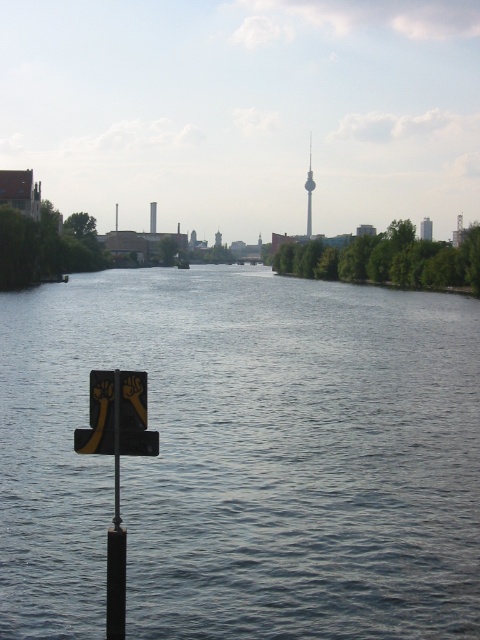
Question: Based on their relative distances, which object is nearer to the yellow matte parking sign at lower left?

Choices:
 (A) blue water at center
 (B) black metal pole at lower left

Answer: (B)

Question: Can you confirm if blue water at center is thinner than black metal pole at lower left?

Choices:
 (A) yes
 (B) no

Answer: (B)

Question: Considering the real-world distances, which object is closest to the black metal pole at lower left?

Choices:
 (A) yellow matte parking sign at lower left
 (B) blue water at center

Answer: (A)

Question: Is blue water at center smaller than yellow matte parking sign at lower left?

Choices:
 (A) yes
 (B) no

Answer: (B)

Question: Which point is closer to the camera taking this photo?

Choices:
 (A) (148, 339)
 (B) (111, 595)

Answer: (B)

Question: Observing the image, what is the correct spatial positioning of blue water at center in reference to black metal pole at lower left?

Choices:
 (A) above
 (B) below

Answer: (A)